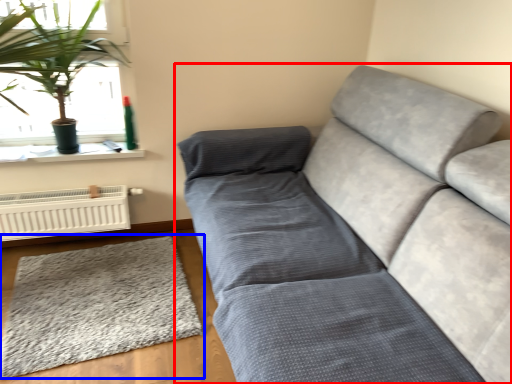
Question: Among these objects, which one is nearest to the camera, studio couch (highlighted by a red box) or mat (highlighted by a blue box)?

Choices:
 (A) studio couch
 (B) mat

Answer: (A)